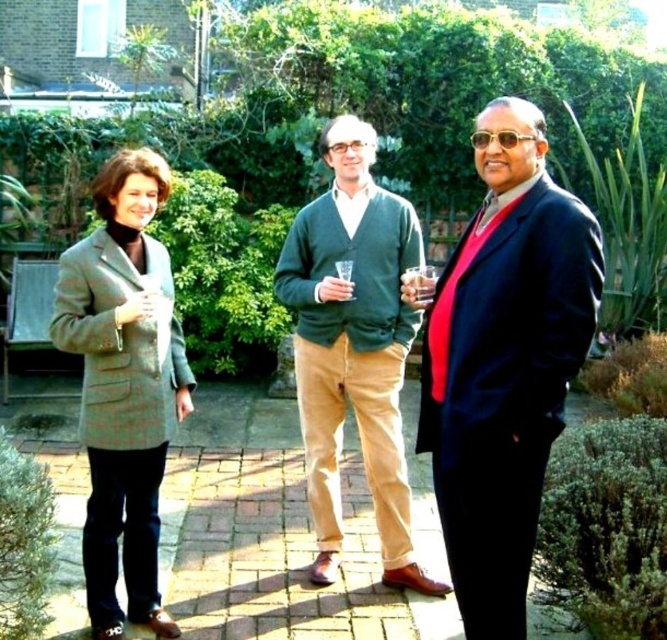
Question: Which object is the farthest from the navy blue suit at center?

Choices:
 (A) translucent plastic cup at center
 (B) green cardigan at center

Answer: (B)

Question: Among these points, which one is farthest from the camera?

Choices:
 (A) (502, 221)
 (B) (109, 323)
 (C) (404, 278)

Answer: (C)

Question: Can you confirm if navy blue suit at center is positioned above green cardigan at center?

Choices:
 (A) yes
 (B) no

Answer: (B)

Question: Among these points, which one is farthest from the camera?

Choices:
 (A) (522, 438)
 (B) (388, 496)
 (C) (87, 579)

Answer: (B)

Question: Can you confirm if navy blue suit at center is positioned to the right of translucent plastic cup at center?

Choices:
 (A) yes
 (B) no

Answer: (A)

Question: Is navy blue suit at center further to the viewer compared to translucent plastic cup at center?

Choices:
 (A) no
 (B) yes

Answer: (A)